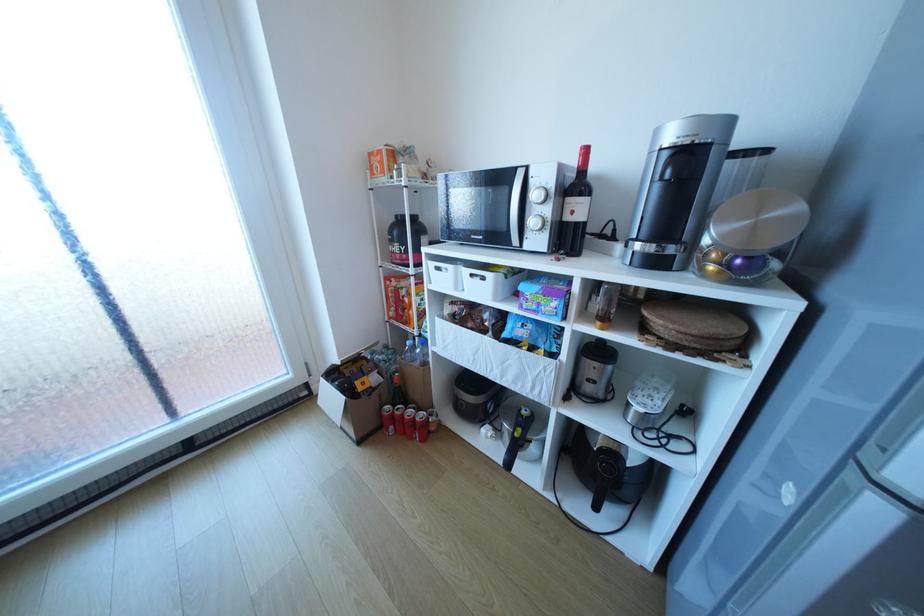
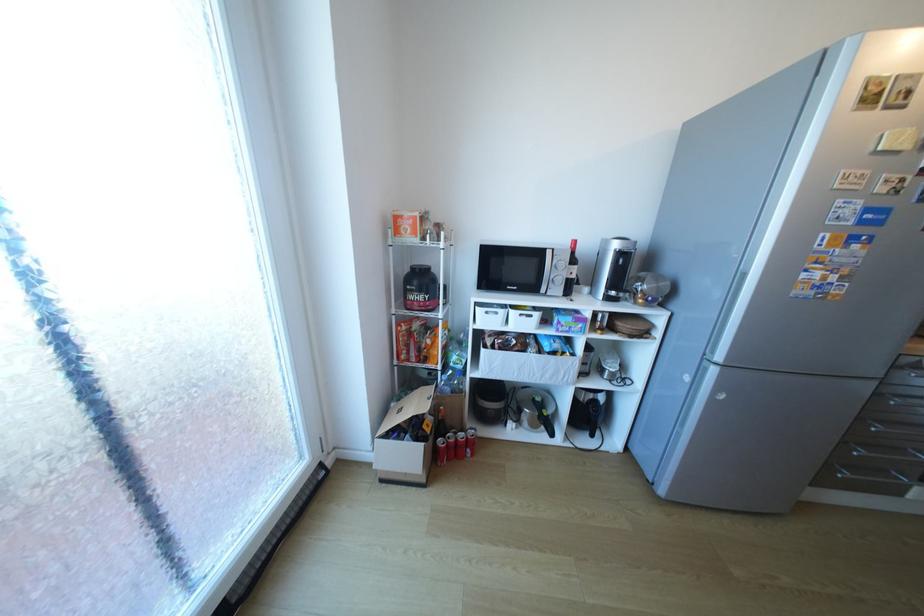
The point at (418, 416) is marked in the first image. Where is the corresponding point in the second image?

(469, 439)